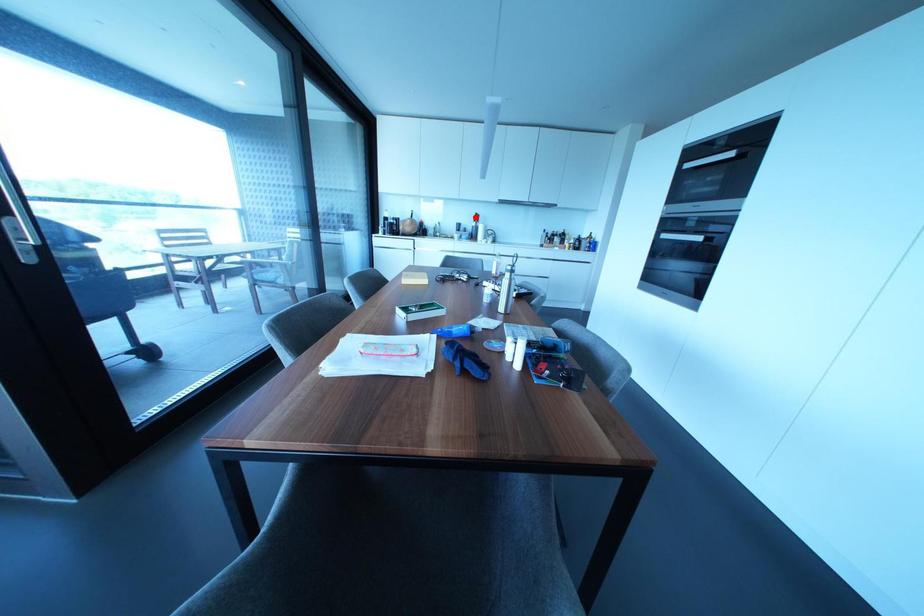
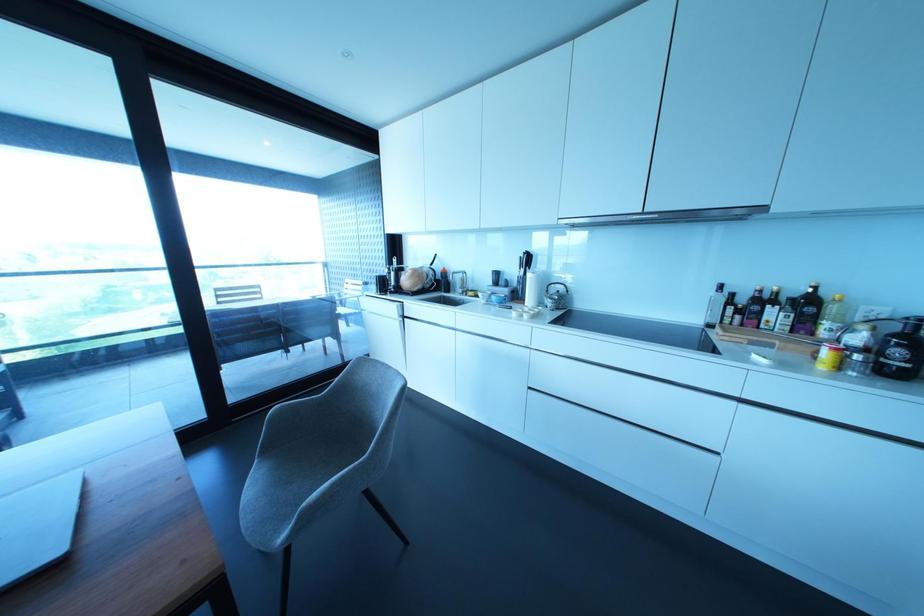
Question: I am providing you with two images of the same scene from different viewpoints. In image1, a red point is highlighted. Considering the same 3D point in image2, which of the following is correct?

Choices:
 (A) It is closer
 (B) It is farther

Answer: (B)